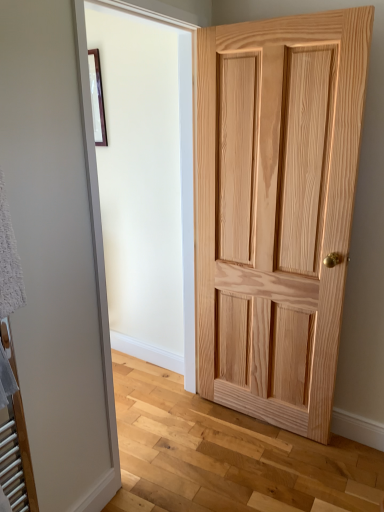
Question: Can you confirm if natural wood door at right is taller than matte black picture frame at upper left?

Choices:
 (A) no
 (B) yes

Answer: (B)

Question: Considering the relative sizes of natural wood door at right and matte black picture frame at upper left in the image provided, is natural wood door at right smaller than matte black picture frame at upper left?

Choices:
 (A) no
 (B) yes

Answer: (A)

Question: Is natural wood door at right at the left side of matte black picture frame at upper left?

Choices:
 (A) no
 (B) yes

Answer: (A)

Question: Does natural wood door at right have a lesser width compared to matte black picture frame at upper left?

Choices:
 (A) no
 (B) yes

Answer: (A)

Question: From the image's perspective, is natural wood door at right located beneath matte black picture frame at upper left?

Choices:
 (A) no
 (B) yes

Answer: (B)

Question: Considering the relative sizes of natural wood door at right and matte black picture frame at upper left in the image provided, is natural wood door at right bigger than matte black picture frame at upper left?

Choices:
 (A) no
 (B) yes

Answer: (B)

Question: Considering the relative sizes of matte black picture frame at upper left and natural wood door at right in the image provided, is matte black picture frame at upper left shorter than natural wood door at right?

Choices:
 (A) yes
 (B) no

Answer: (A)

Question: Can you confirm if matte black picture frame at upper left is bigger than natural wood door at right?

Choices:
 (A) no
 (B) yes

Answer: (A)

Question: From the image's perspective, is matte black picture frame at upper left located beneath natural wood door at right?

Choices:
 (A) no
 (B) yes

Answer: (A)

Question: Can you see matte black picture frame at upper left touching natural wood door at right?

Choices:
 (A) yes
 (B) no

Answer: (B)

Question: Is natural wood door at right surrounded by matte black picture frame at upper left?

Choices:
 (A) yes
 (B) no

Answer: (B)

Question: Is matte black picture frame at upper left in front of natural wood door at right?

Choices:
 (A) no
 (B) yes

Answer: (A)

Question: Is natural wood door at right wider or thinner than matte black picture frame at upper left?

Choices:
 (A) wide
 (B) thin

Answer: (A)